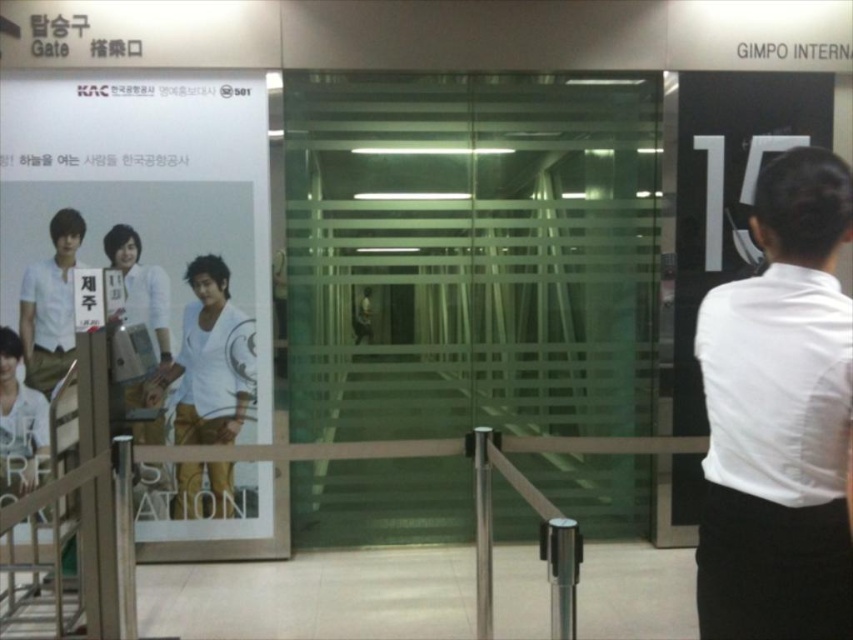
Question: Does white glossy poster at left appear on the left side of white matte shirt at center?

Choices:
 (A) no
 (B) yes

Answer: (B)

Question: Which object is closer to the camera taking this photo?

Choices:
 (A) white smooth shirt at right
 (B) white matte shirt at center
 (C) white glossy poster at left

Answer: (A)

Question: Which is farther from the white matte shirt at center?

Choices:
 (A) white smooth shirt at right
 (B) white glossy poster at left

Answer: (A)

Question: Which of the following is the closest to the observer?

Choices:
 (A) (64, 179)
 (B) (215, 305)

Answer: (A)

Question: Is white smooth shirt at right positioned in front of white matte shirt at center?

Choices:
 (A) no
 (B) yes

Answer: (B)

Question: Can you confirm if white smooth shirt at right is positioned below white glossy poster at left?

Choices:
 (A) yes
 (B) no

Answer: (A)